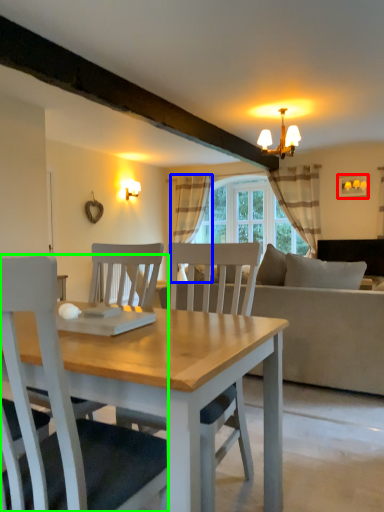
Question: Based on their relative distances, which object is farther from picture frame (highlighted by a red box)? Choose from curtain (highlighted by a blue box) and chair (highlighted by a green box).

Choices:
 (A) curtain
 (B) chair

Answer: (B)